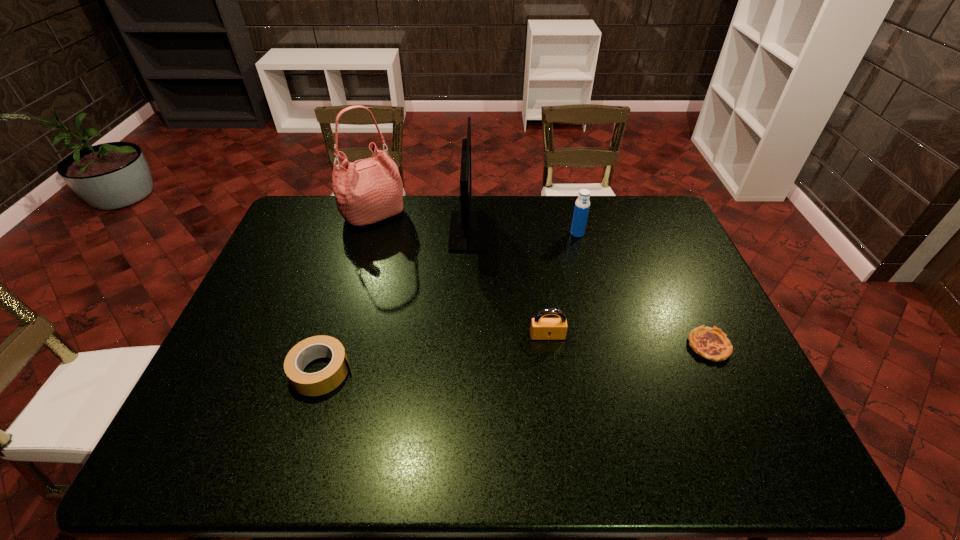
You are a GUI agent. You are given a task and a screenshot of the screen. Output one action in this format:
    pyautogui.click(x=<x>, y=<y>)
    Task: Click on the vacant space at the far edge
    Image resolution: width=960 pixels, height=540 pixels.
    Given the screenshot: What is the action you would take?
    pyautogui.click(x=541, y=205)

Where is `vacant area at the near edge`? This screenshot has width=960, height=540. vacant area at the near edge is located at coordinates (271, 438).

The image size is (960, 540). I want to click on free space at the left edge of the desktop, so click(284, 267).

Image resolution: width=960 pixels, height=540 pixels. In the image, there is a desktop. Find the location of `free region at the right edge`. free region at the right edge is located at coordinates (667, 240).

In the image, there is a desktop. Find the location of `vacant region at the far left corner`. vacant region at the far left corner is located at coordinates (330, 219).

Image resolution: width=960 pixels, height=540 pixels. What are the coordinates of `free space between the water bottle and the quiche` in the screenshot? It's located at (643, 289).

Locate an element on the screen. The height and width of the screenshot is (540, 960). free space between the duct tape and the tallest object is located at coordinates (348, 293).

Locate an element on the screen. free spot between the third object from left to right and the rightmost object is located at coordinates (588, 288).

The image size is (960, 540). What are the coordinates of `free point between the second tallest object and the shortest object` in the screenshot? It's located at (588, 288).

Identify the location of vacant area that lies between the handbag and the quiche. (541, 280).